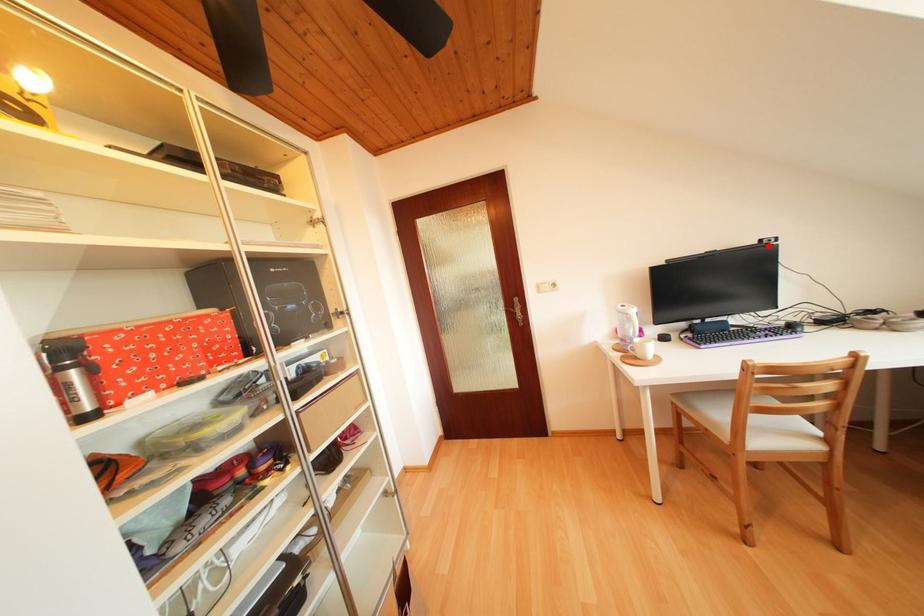
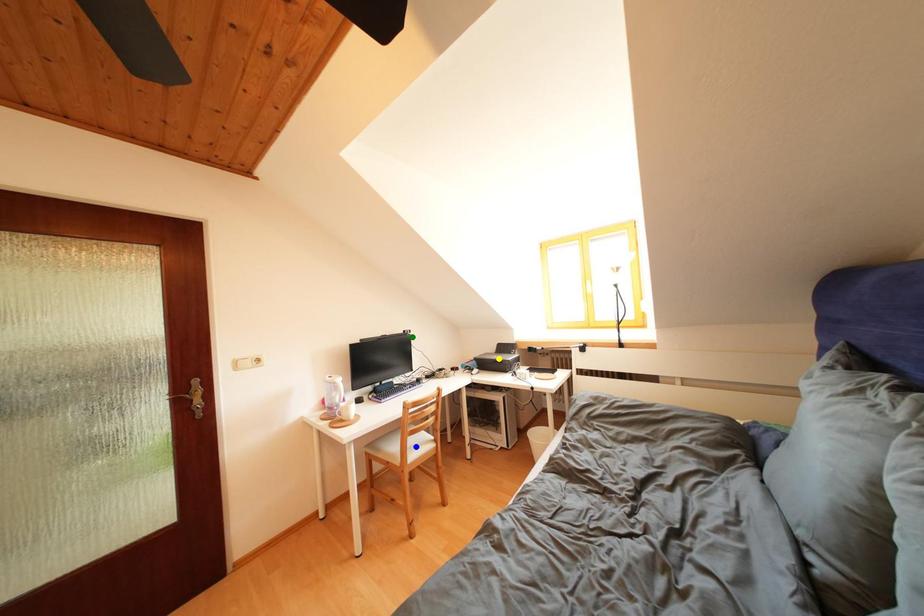
Question: I am providing you with two images of the same scene from different viewpoints. A red point is marked on the first image. You are given multiple points on the second image. Which spot in image 2 lines up with the point in image 1?

Choices:
 (A) yellow point
 (B) green point
 (C) blue point

Answer: (B)